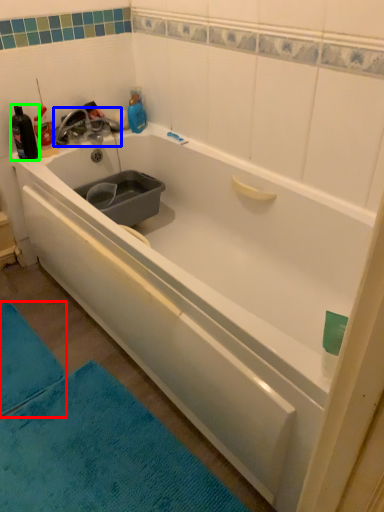
Question: Considering the real-world distances, which object is farthest from bath mat (highlighted by a red box)? tap (highlighted by a blue box) or bottle (highlighted by a green box)?

Choices:
 (A) tap
 (B) bottle

Answer: (A)